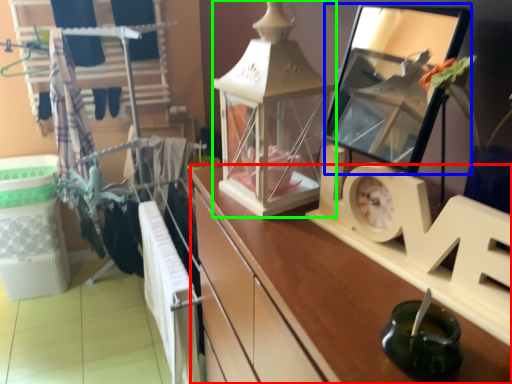
Question: Based on their relative distances, which object is farther from cabinetry (highlighted by a red box)? Choose from mirror (highlighted by a blue box) and writing (highlighted by a green box).

Choices:
 (A) mirror
 (B) writing

Answer: (A)